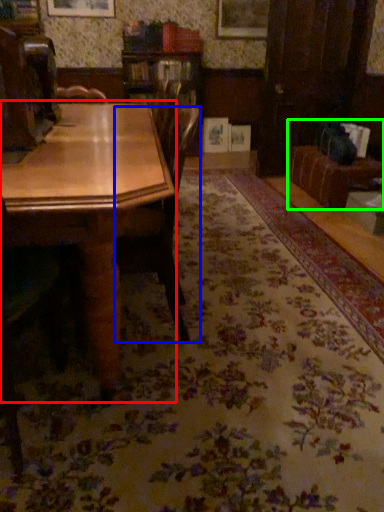
Question: Which object is the farthest from table (highlighted by a red box)? Choose among these: chair (highlighted by a blue box) or couch (highlighted by a green box).

Choices:
 (A) chair
 (B) couch

Answer: (B)